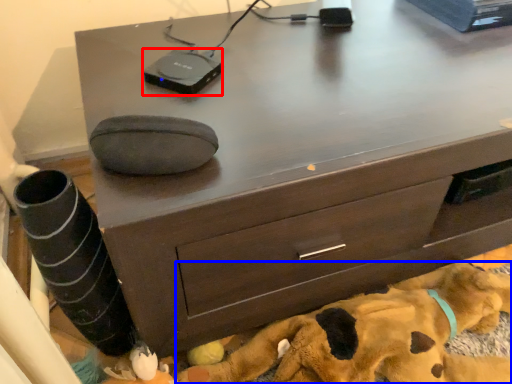
Question: Which of the following is the closest to the observer, gadget (highlighted by a red box) or dog (highlighted by a blue box)?

Choices:
 (A) gadget
 (B) dog

Answer: (B)